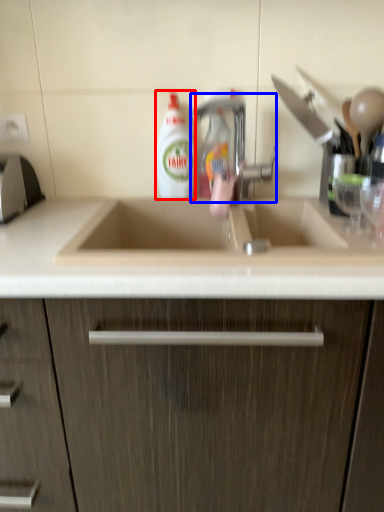
Question: Which object appears closest to the camera in this image, cleaning product (highlighted by a red box) or tap (highlighted by a blue box)?

Choices:
 (A) cleaning product
 (B) tap

Answer: (B)